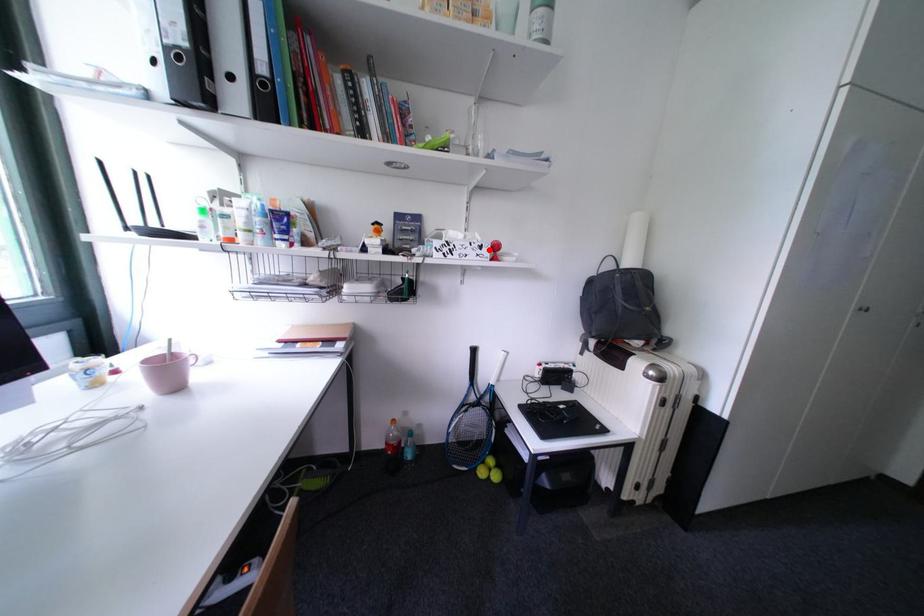
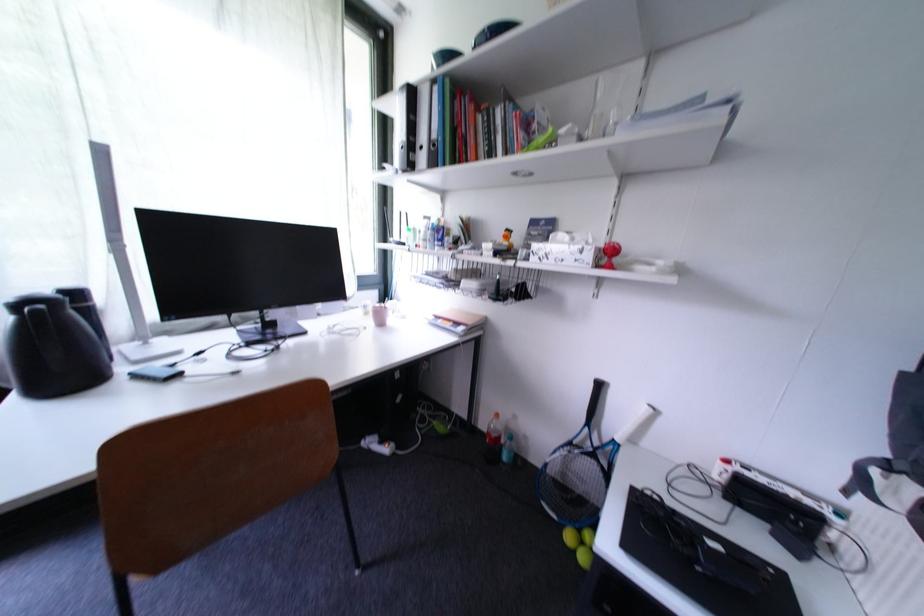
Where in the second image is the point corresponding to the highlighted location from the first image?

(590, 253)